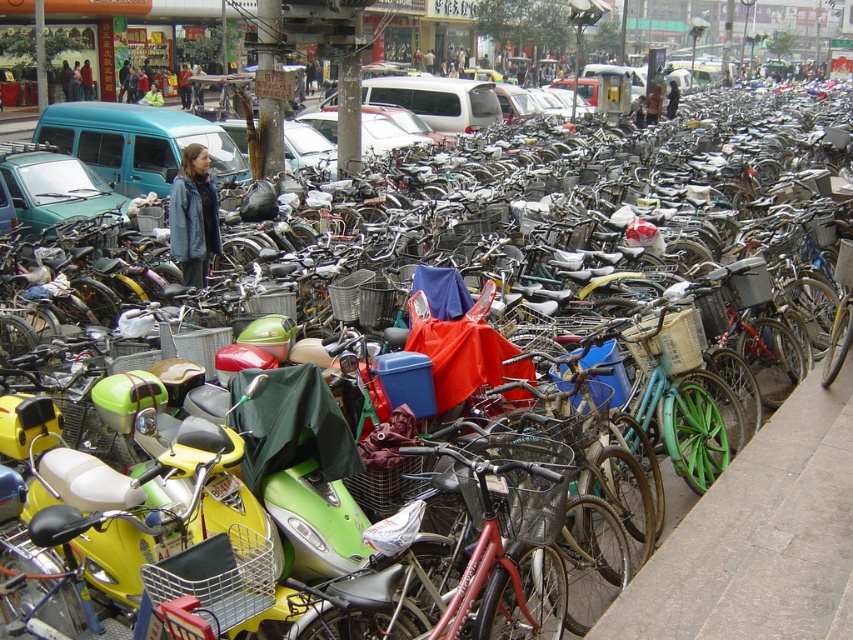
Question: In this image, where is gray concrete pavement at lower right located relative to yellow matte scooter at lower left?

Choices:
 (A) below
 (B) above

Answer: (A)

Question: Is gray concrete pavement at lower right wider than matte green van at left?

Choices:
 (A) no
 (B) yes

Answer: (A)

Question: Among these objects, which one is farthest from the camera?

Choices:
 (A) yellow matte scooter at lower left
 (B) gray concrete pavement at lower right

Answer: (B)

Question: Which object is closer to the camera taking this photo?

Choices:
 (A) matte green van at left
 (B) yellow matte scooter at lower left

Answer: (B)

Question: Which of the following is the closest to the observer?

Choices:
 (A) (184, 518)
 (B) (21, 154)

Answer: (A)

Question: From the image, what is the correct spatial relationship of gray concrete pavement at lower right in relation to matte green van at left?

Choices:
 (A) right
 (B) left

Answer: (A)